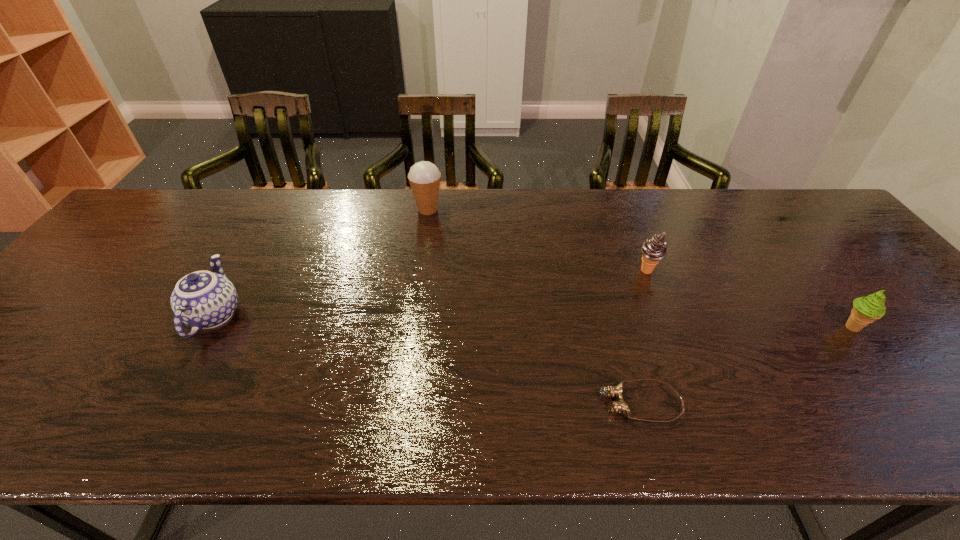
Find the location of a particular element. This screenshot has height=540, width=960. vacant space that satisfies the following two spatial constraints: 1. at the spout of the second icecream from right to left; 2. on the right side of the chinaware is located at coordinates (239, 271).

I want to click on vacant space that satisfies the following two spatial constraints: 1. at the spout of the second icecream from left to right; 2. on the right side of the leftmost object, so click(239, 271).

Locate an element on the screen. This screenshot has height=540, width=960. vacant space that satisfies the following two spatial constraints: 1. at the spout of the fourth object from left to right; 2. on the right side of the chinaware is located at coordinates (239, 271).

Locate an element on the screen. The height and width of the screenshot is (540, 960). vacant point that satisfies the following two spatial constraints: 1. on the front side of the rightmost icecream; 2. on the front lenses and sides of the third object from right to left is located at coordinates (911, 403).

Locate an element on the screen. free space that satisfies the following two spatial constraints: 1. at the spout of the farthest object; 2. on the left side of the leftmost object is located at coordinates 275,210.